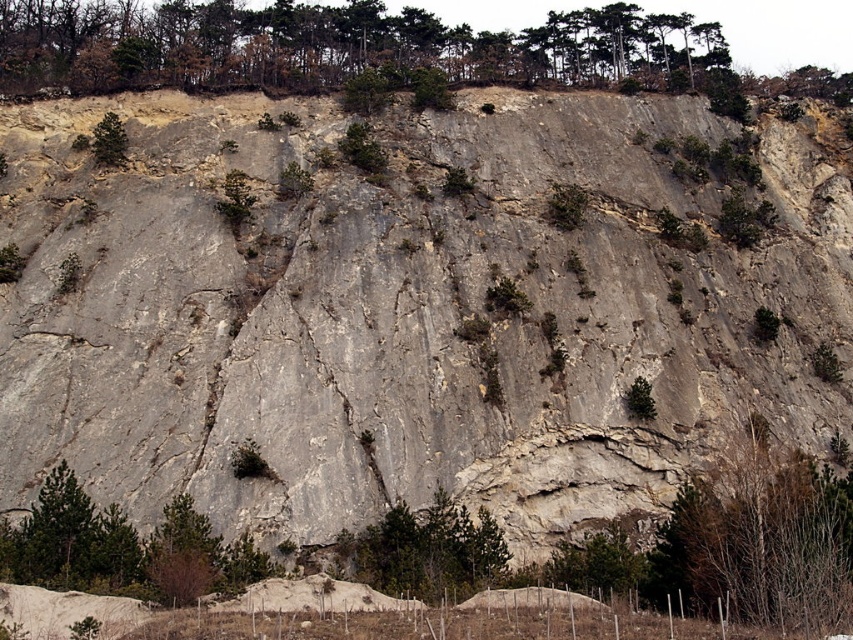
You are a hiker trying to navigate between the green leafy trees at upper center and the green matte tree at upper left. The trail you need to take is exactly 120 feet long. Will you reach your destination before the trail ends?

The distance between the green leafy trees at upper center and the green matte tree at upper left is 122.81 feet, which is longer than the 120 feet trail. Therefore, you will not reach the destination before the trail ends.